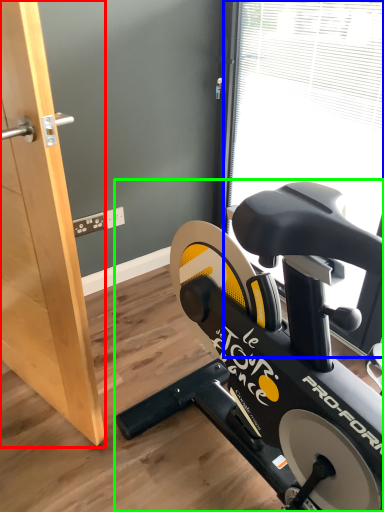
Question: Considering the real-world distances, which object is farthest from screen door (highlighted by a red box)? window screen (highlighted by a blue box) or stationary bicycle (highlighted by a green box)?

Choices:
 (A) window screen
 (B) stationary bicycle

Answer: (A)